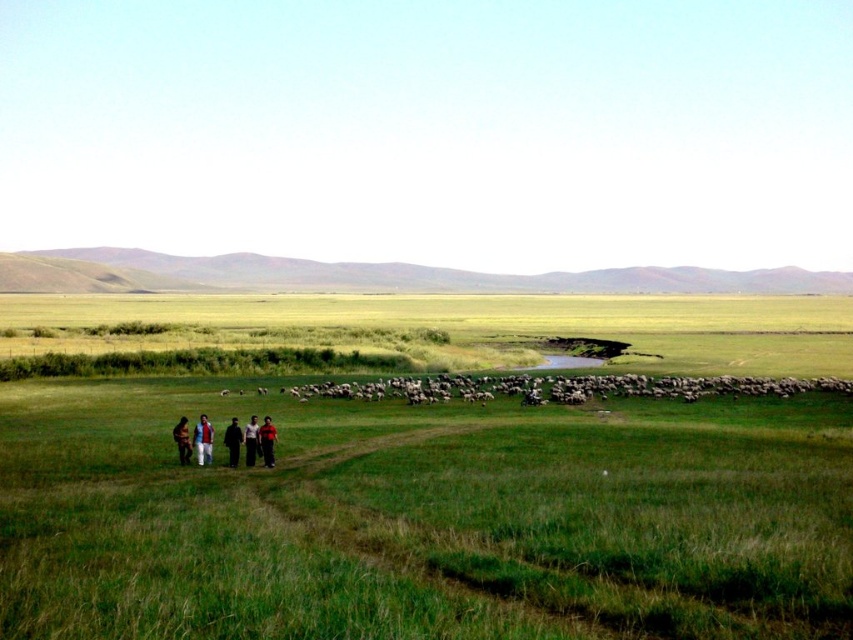
You are a photographer standing at the edge of the dirt path in the grassland. You want to take a photo of the dark brown leather jacket at lower center and the black fabric person at lower center. How far apart are these two subjects in feet?

The dark brown leather jacket at lower center is 4.21 feet from the black fabric person at lower center.

You are standing at the point marked by the coordinates point (202, 440) in the image. Looking towards the group of people near the left side, can you see the light brown fabric jacket at lower left?

Yes, the point (202, 440) corresponds to the light brown fabric jacket at lower left, so you are standing directly at the location of the light brown fabric jacket at lower left. Therefore, you would be facing away from the group of people near the left side and would not be able to see them in that direction.

You are standing at the origin point of the image coordinate system. You want to move towards the light brown fabric jacket at lower left. What direction should you move in?

Since the light brown fabric jacket at lower left is located at point 0.689 in the x direction and 0.239 in the y direction, you should move to the right and slightly downward to reach it.